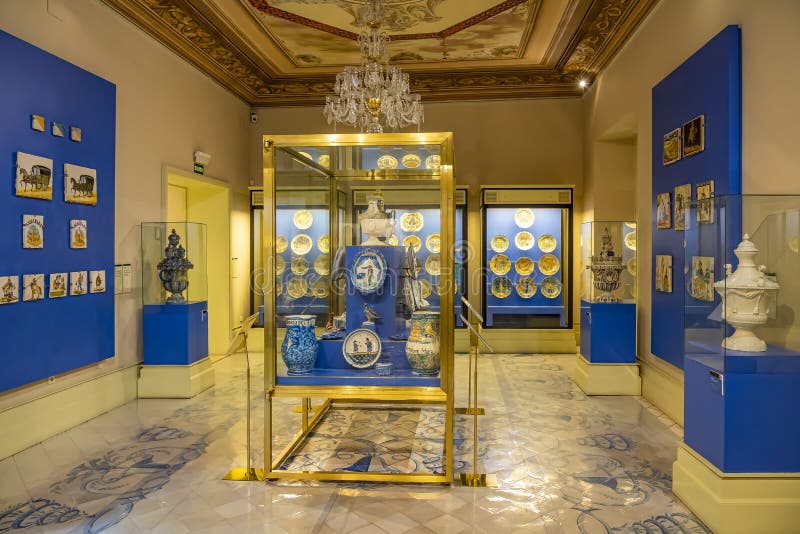
Where is `blue plush`? The width and height of the screenshot is (800, 534). blue plush is located at coordinates (501, 227), (458, 226), (288, 230), (716, 84), (18, 74).